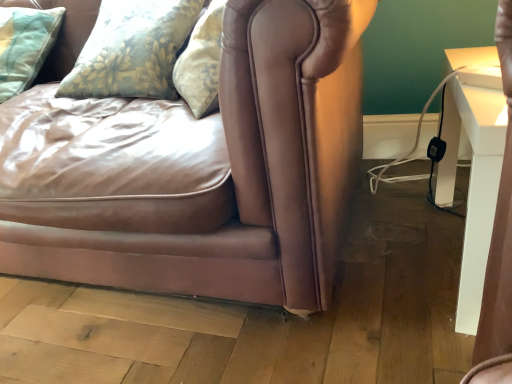
Question: From their relative heights in the image, would you say floral fabric pillow at upper left, which is the 1th pillow from right to left, is taller or shorter than white glossy table at right?

Choices:
 (A) tall
 (B) short

Answer: (B)

Question: From a real-world perspective, is floral fabric pillow at upper left, arranged as the second pillow when viewed from the left, physically located above or below white glossy table at right?

Choices:
 (A) below
 (B) above

Answer: (B)

Question: Which of these objects is positioned farthest from the floral fabric pillow at upper left, which is the 1th pillow from right to left?

Choices:
 (A) light blue quilted pillow at upper left, acting as the first pillow starting from the left
 (B) white glossy table at right
 (C) matte brown leather couch at center

Answer: (B)

Question: Estimate the real-world distances between objects in this image. Which object is farther from the light blue quilted pillow at upper left, acting as the first pillow starting from the left?

Choices:
 (A) floral fabric pillow at upper left, arranged as the second pillow when viewed from the left
 (B) white glossy table at right
 (C) matte brown leather couch at center

Answer: (B)